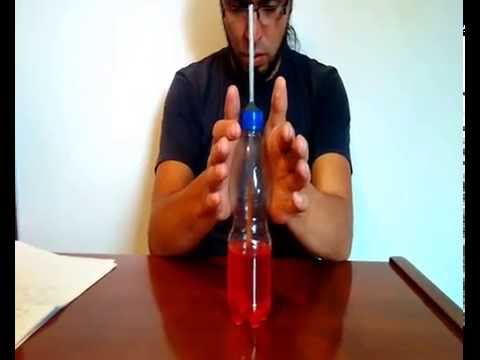
Identify the location of desktop to place items on. point(136,310).